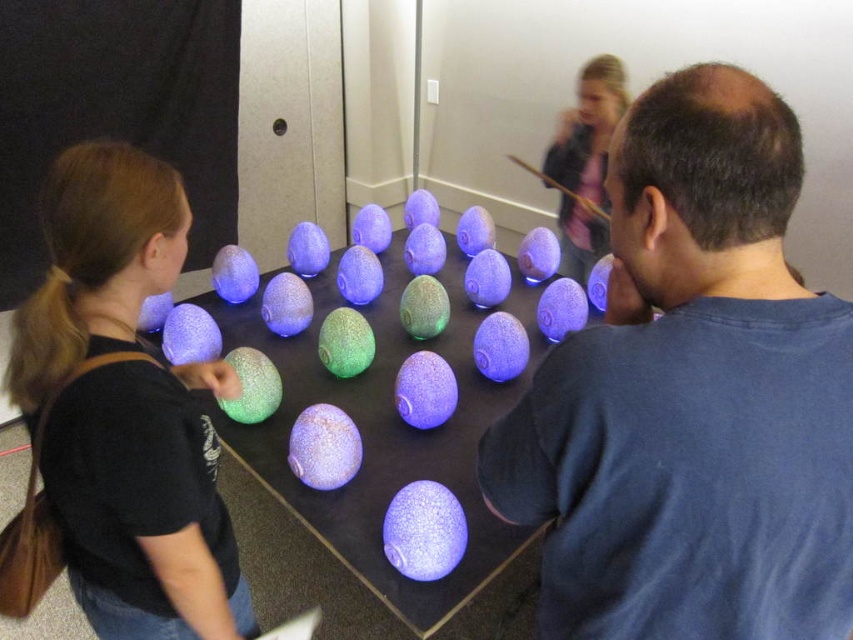
Is point (164, 413) closer to camera compared to point (465, 512)?

That is True.

Does matte black shirt at center appear on the left side of speckled glass eggs at center?

Correct, you'll find matte black shirt at center to the left of speckled glass eggs at center.

Between point (85, 360) and point (485, 550), which one is positioned in front?

Point (85, 360) is in front.

At what (x,y) coordinates should I click in order to perform the action: click on matte black shirt at center. Please return your answer as a coordinate pair (x, y). Looking at the image, I should click on (119, 417).

Is matte blue egg at center bigger than matte black shirt at center?

Actually, matte blue egg at center might be smaller than matte black shirt at center.

Is point (734, 156) positioned in front of point (154, 592)?

Yes, it is in front of point (154, 592).

Locate an element on the screen. This screenshot has width=853, height=640. matte blue egg at center is located at coordinates (692, 396).

Who is positioned more to the right, matte blue egg at center or speckled glass eggs at center?

Positioned to the right is matte blue egg at center.

Which is in front, point (763, 406) or point (277, 413)?

Positioned in front is point (763, 406).

This screenshot has height=640, width=853. I want to click on matte blue egg at center, so click(x=692, y=396).